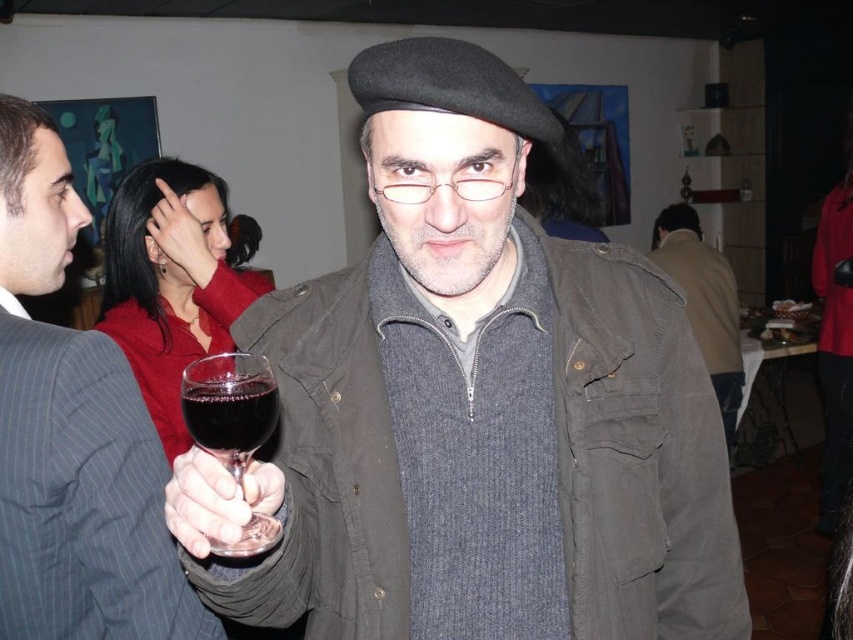
Who is positioned more to the left, transparent glass at center or gray wool sweater at center?

From the viewer's perspective, transparent glass at center appears more on the left side.

Between transparent glass at center and gray wool sweater at center, which one has more height?

gray wool sweater at center

Where is `transparent glass at center`? This screenshot has height=640, width=853. transparent glass at center is located at coordinates (229, 406).

Is matte black beret at center smaller than matte black hand at upper center?

Incorrect, matte black beret at center is not smaller in size than matte black hand at upper center.

Which of these two, matte black beret at center or matte black hand at upper center, stands taller?

matte black beret at center is taller.

Which is behind, point (590, 257) or point (158, 211)?

The point (158, 211) is more distant.

Locate an element on the screen. The height and width of the screenshot is (640, 853). matte black beret at center is located at coordinates (473, 406).

Can you confirm if matte black beret at upper center is bigger than transparent glass at center?

Correct, matte black beret at upper center is larger in size than transparent glass at center.

Is point (73, 340) more distant than point (186, 416)?

Yes, it is.

Is point (25, 230) positioned after point (216, 552)?

Yes, it is.

The height and width of the screenshot is (640, 853). I want to click on matte black beret at upper center, so click(73, 435).